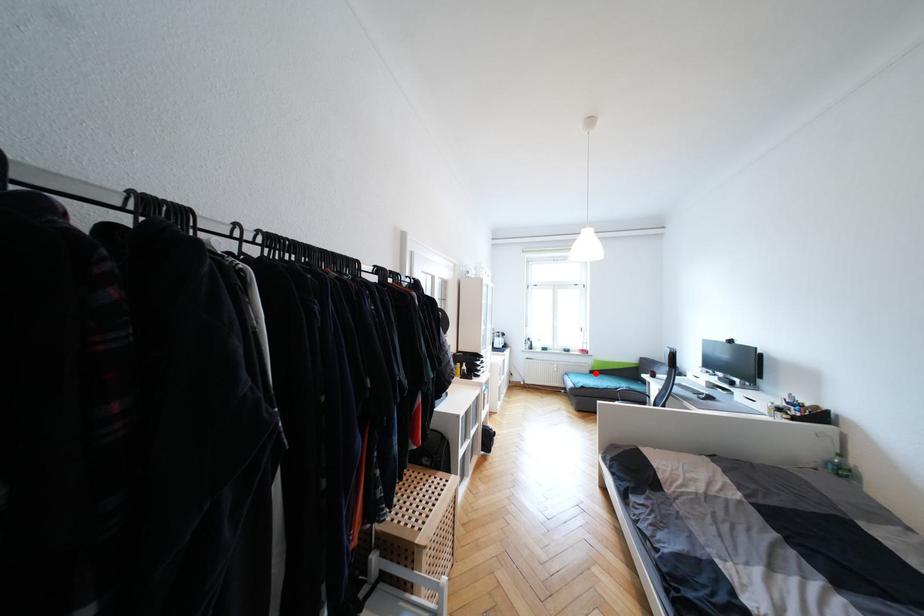
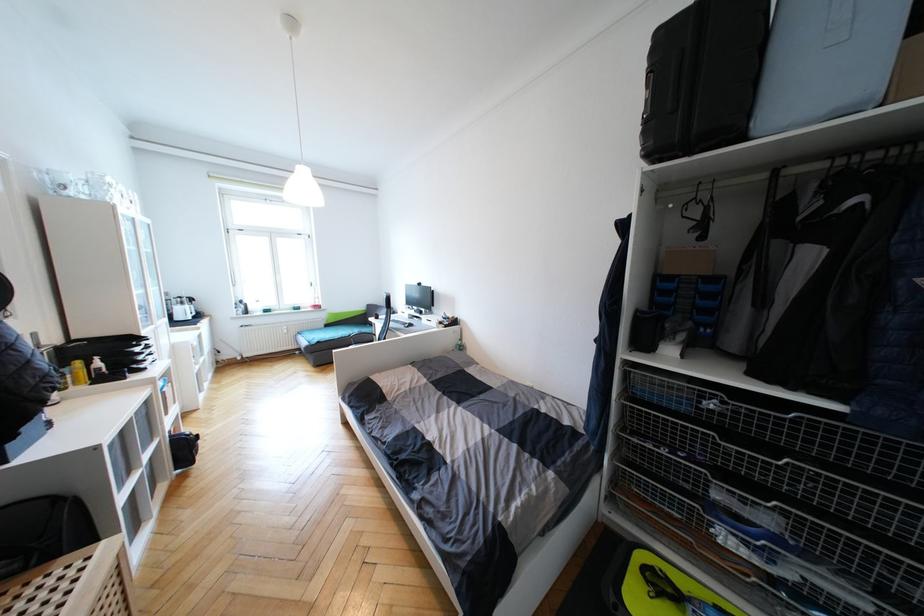
Question: I am providing you with two images of the same scene from different viewpoints. Given a red point in image1, look at the same physical point in image2. Is it:

Choices:
 (A) Closer to the viewpoint
 (B) Farther from the viewpoint

Answer: (A)